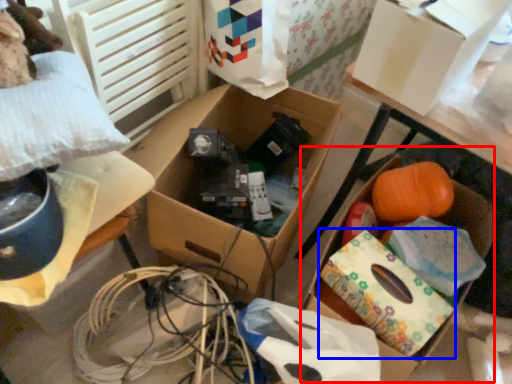
Question: Which point is further to the camera, storage box (highlighted by a red box) or cardboard box (highlighted by a blue box)?

Choices:
 (A) storage box
 (B) cardboard box

Answer: (A)